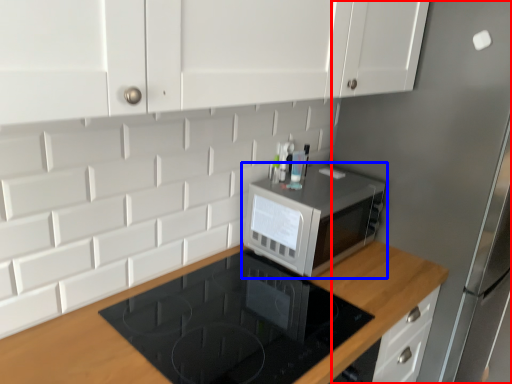
Question: Which of the following is the closest to the observer, fridge (highlighted by a red box) or microwave oven (highlighted by a blue box)?

Choices:
 (A) fridge
 (B) microwave oven

Answer: (A)